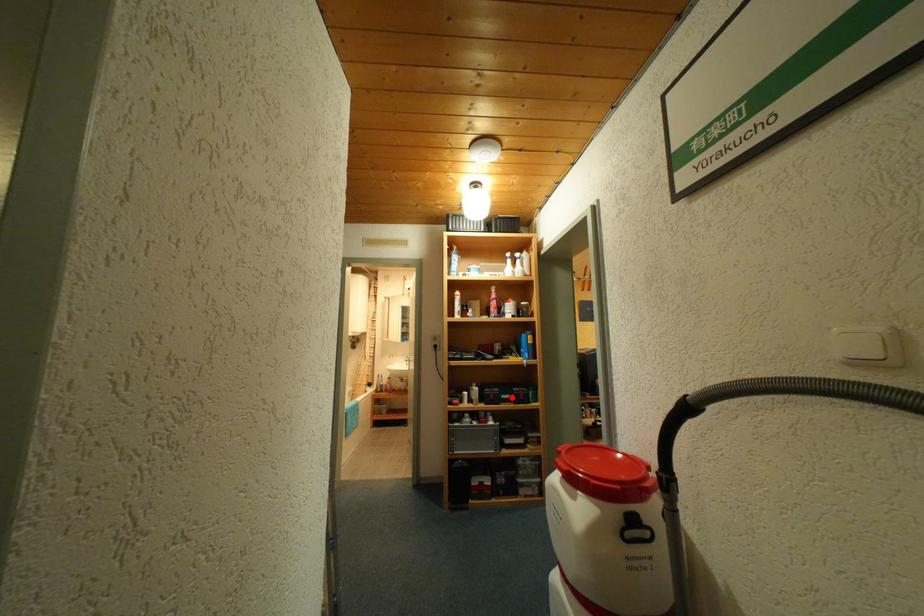
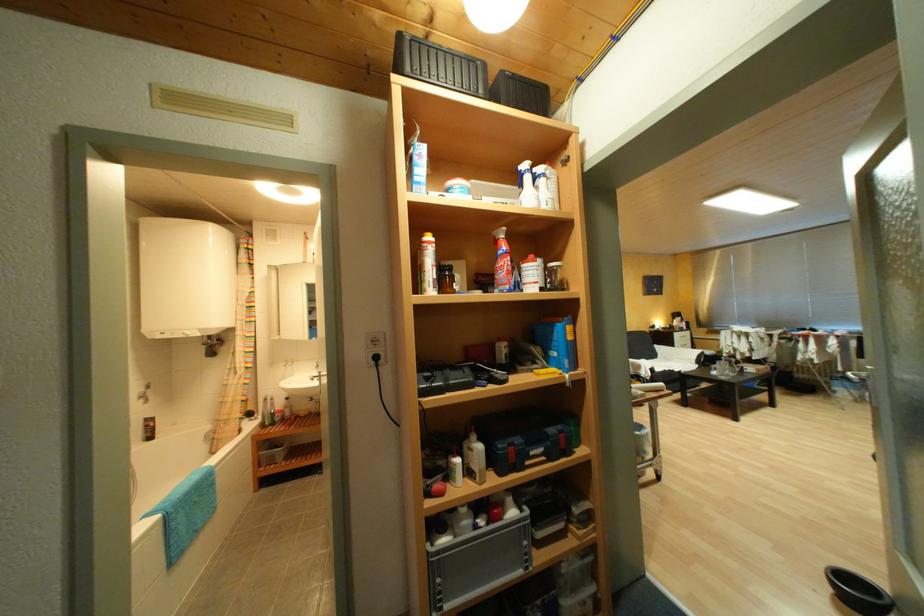
The point at the highlighted location is marked in the first image. Where is the corresponding point in the second image?

(541, 454)